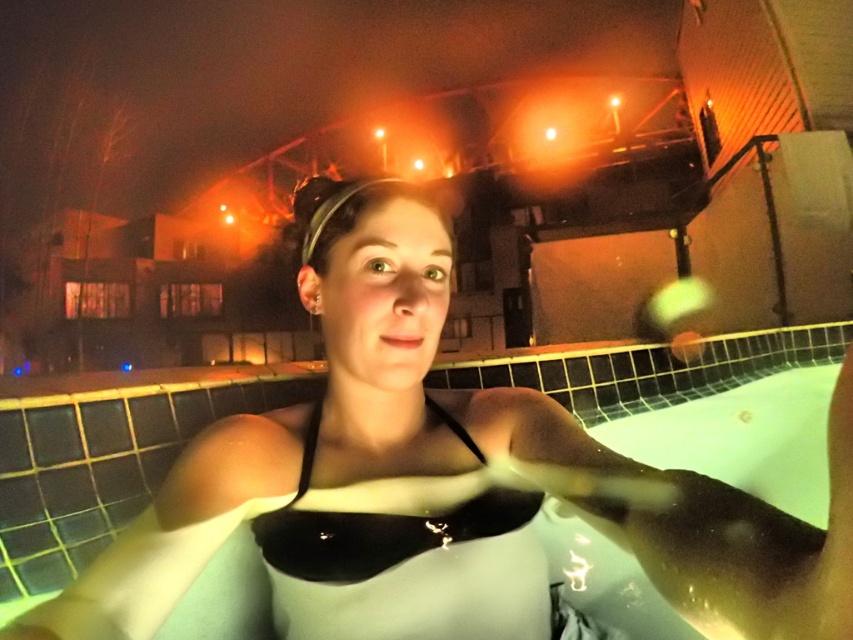
Question: Does white matte swimsuit at center appear on the right side of black matte bikini top at center?

Choices:
 (A) no
 (B) yes

Answer: (B)

Question: Does white matte swimsuit at center have a greater width compared to black matte bikini top at center?

Choices:
 (A) no
 (B) yes

Answer: (B)

Question: Which point is closer to the camera taking this photo?

Choices:
 (A) (474, 484)
 (B) (349, 552)

Answer: (B)

Question: Is white matte swimsuit at center closer to camera compared to black matte bikini top at center?

Choices:
 (A) yes
 (B) no

Answer: (A)

Question: Among these objects, which one is farthest from the camera?

Choices:
 (A) black matte bikini top at center
 (B) white matte swimsuit at center

Answer: (A)